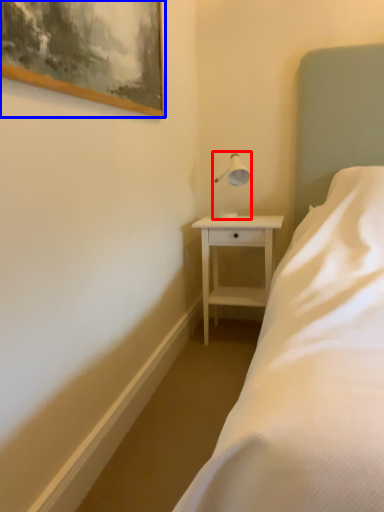
Question: Which point is further to the camera, table lamp (highlighted by a red box) or picture frame (highlighted by a blue box)?

Choices:
 (A) table lamp
 (B) picture frame

Answer: (A)